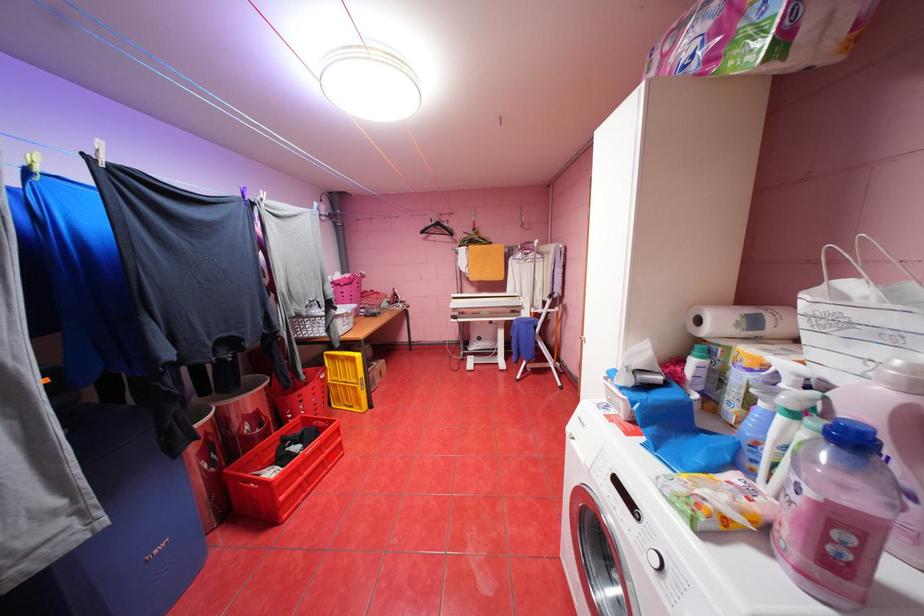
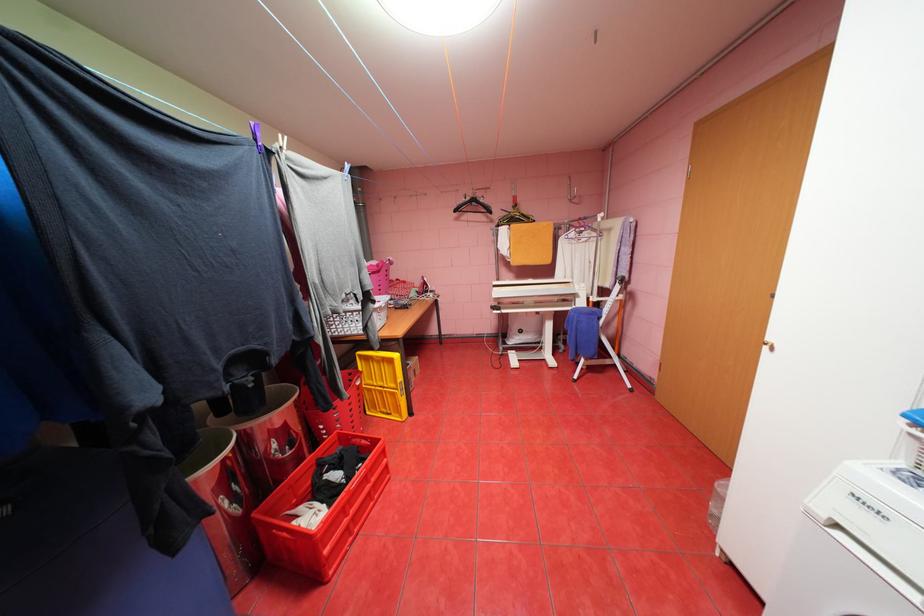
Find the pixel in the second image that matches the highlighted location in the first image.

(377, 485)